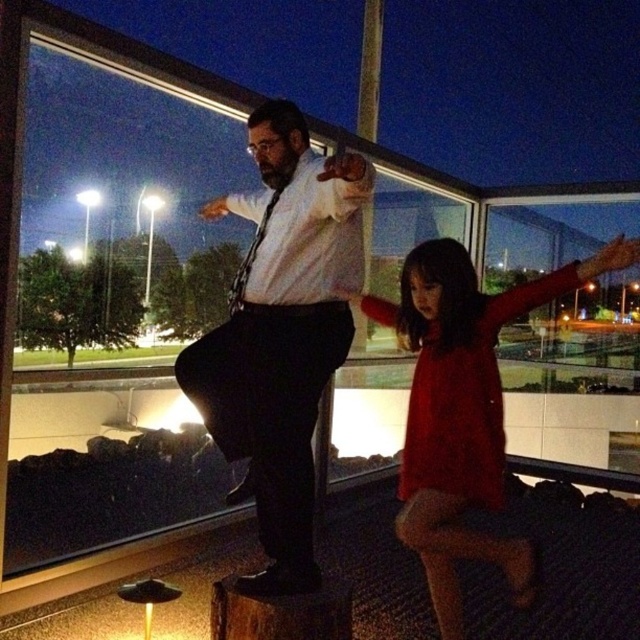
Question: Is matte white shirt at center below matte red dress at center?

Choices:
 (A) no
 (B) yes

Answer: (A)

Question: Which point is farther to the camera?

Choices:
 (A) matte white shirt at center
 (B) matte red dress at center

Answer: (B)

Question: Is matte white shirt at center to the left of matte red dress at center from the viewer's perspective?

Choices:
 (A) yes
 (B) no

Answer: (A)

Question: Which of the following is the farthest from the observer?

Choices:
 (A) matte white shirt at center
 (B) matte red dress at center

Answer: (B)

Question: Observing the image, what is the correct spatial positioning of matte white shirt at center in reference to matte red dress at center?

Choices:
 (A) left
 (B) right

Answer: (A)